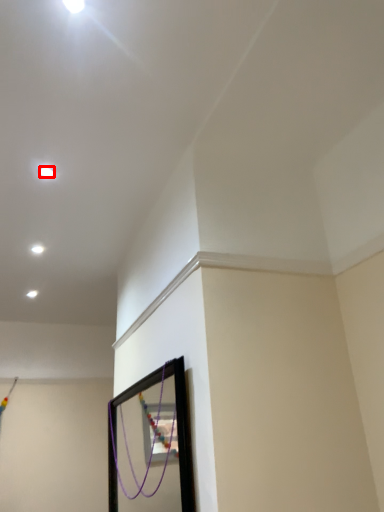
Question: From the image, what is the correct spatial relationship of light (annotated by the red box) in relation to light?

Choices:
 (A) right
 (B) left

Answer: (A)